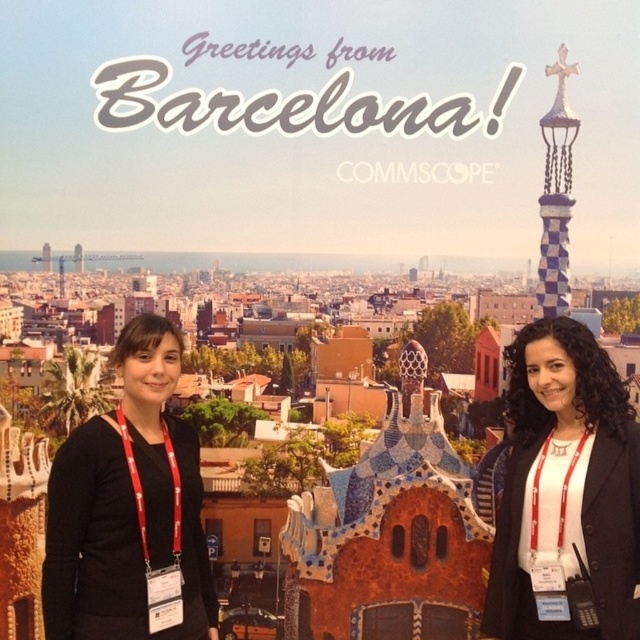
You are taking a photo in front of the Barcelona backdrop. You need to ensure the black matte jacket at right is visible in the frame. Based on its coordinates, where should you position the jacket relative to the backdrop?

The black matte jacket at right is located at point coordinates [564,486], which places it in the lower right quadrant of the image. To ensure visibility, position the jacket towards the lower right area of the backdrop.

You are a photographer who needs to take a photo of the black matte jacket at right from a distance. The camera has a maximum range of 150 feet. Can you capture the jacket clearly?

The black matte jacket at right and camera are 170.66 feet apart, which exceeds the camera maximum range of 150 feet. Therefore, the jacket cannot be captured clearly.

You are a photographer setting up for a group photo in front of the Barcelona backdrop. You need to ensure that the black matte jacket at right and the black fabric at left are both visible in the frame. Based on their positions, which object should you focus on first to ensure both are in the shot?

The black matte jacket at right is above the black fabric at left, so focusing on the jacket first will help ensure both are included in the frame as the fabric is below it.